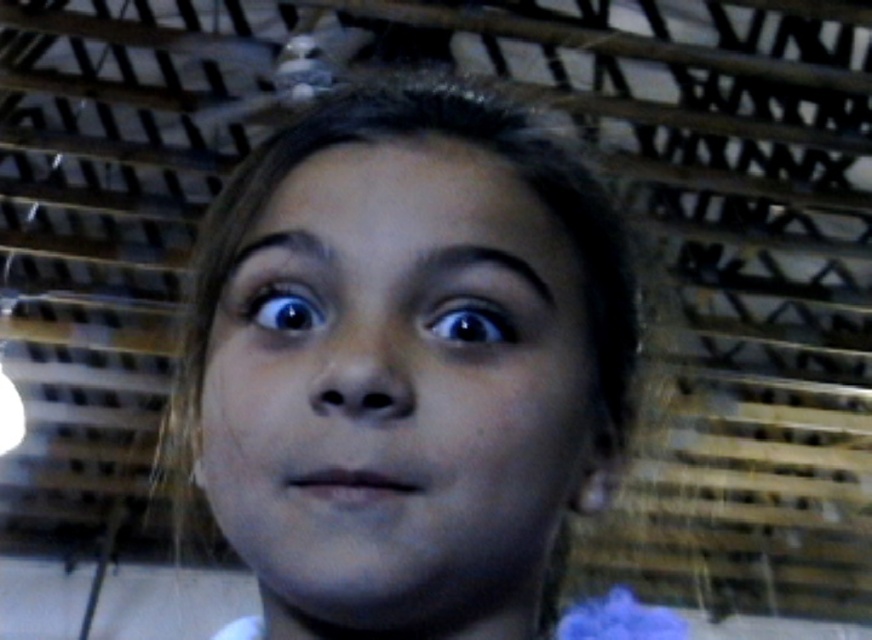
Does smooth skin face at center appear on the left side of black glossy eye at center?

Correct, you'll find smooth skin face at center to the left of black glossy eye at center.

Which is in front, point (366, 563) or point (471, 324)?

Point (366, 563) is more forward.

Which is behind, point (358, 614) or point (487, 310)?

Positioned behind is point (487, 310).

The height and width of the screenshot is (640, 872). In order to click on smooth skin face at center in this screenshot , I will do `click(399, 388)`.

Between black glossy eye at center and blue glossy eye at center, which one appears on the right side from the viewer's perspective?

black glossy eye at center is more to the right.

Does black glossy eye at center have a greater width compared to blue glossy eye at center?

Incorrect, black glossy eye at center's width does not surpass blue glossy eye at center's.

Where is `black glossy eye at center`? This screenshot has height=640, width=872. black glossy eye at center is located at coordinates (469, 321).

Locate an element on the screen. Image resolution: width=872 pixels, height=640 pixels. black glossy eye at center is located at coordinates (469, 321).

Between smooth skin face at center and blue glossy eye at center, which one has less height?

blue glossy eye at center is shorter.

Does point (342, 406) lie in front of point (281, 285)?

That is True.

Is point (413, 384) closer to viewer compared to point (260, 301)?

Yes, it is.

This screenshot has width=872, height=640. Identify the location of smooth skin face at center. (399, 388).